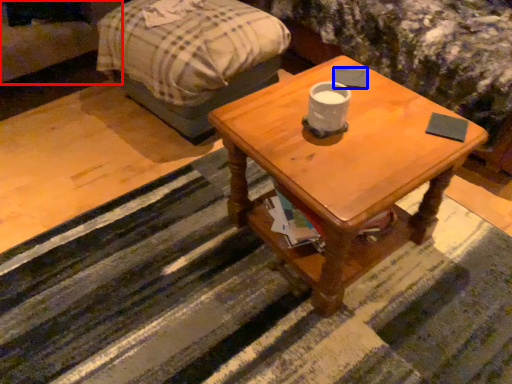
Question: Which point is further to the camera, couch (highlighted by a red box) or pad (highlighted by a blue box)?

Choices:
 (A) couch
 (B) pad

Answer: (A)